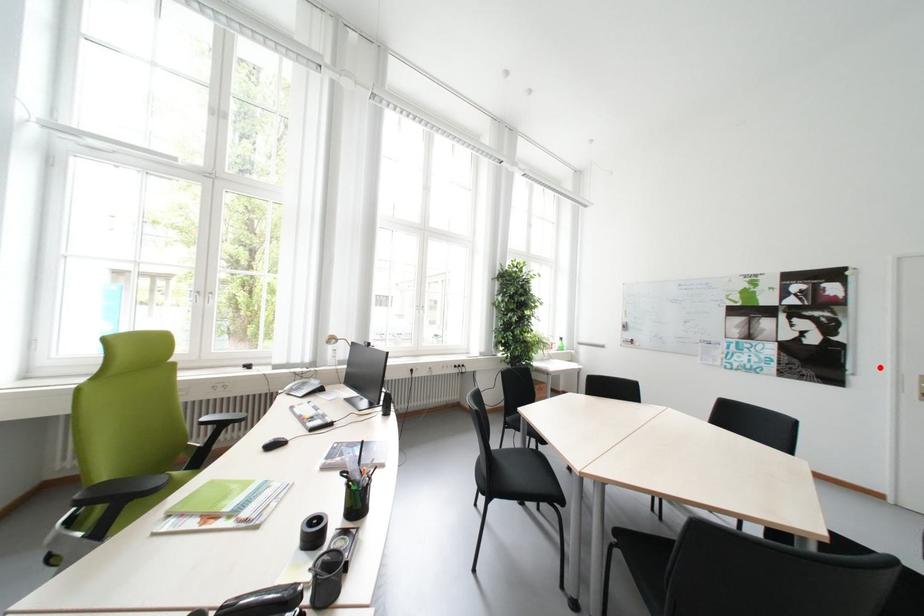
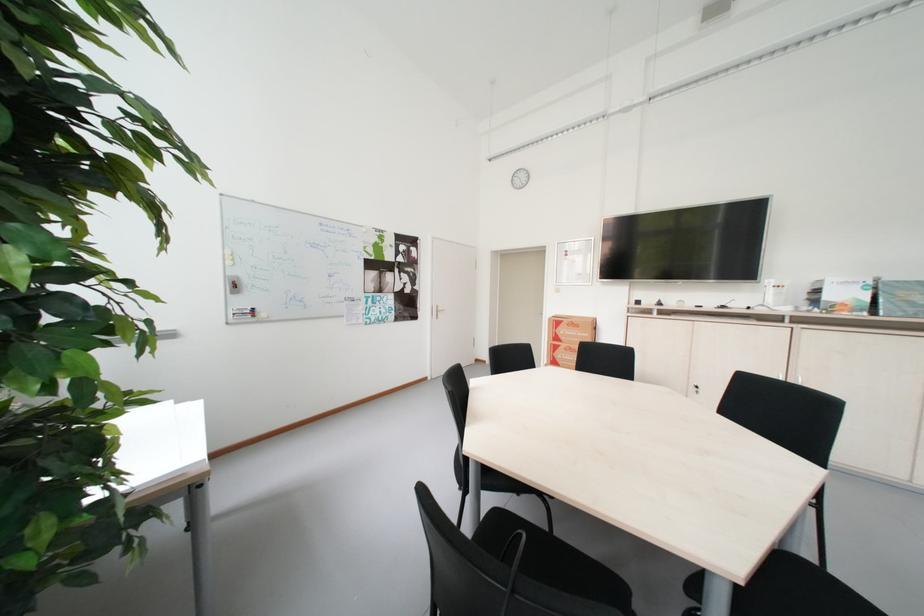
Find the pixel in the second image that matches the highlighted location in the first image.

(434, 305)